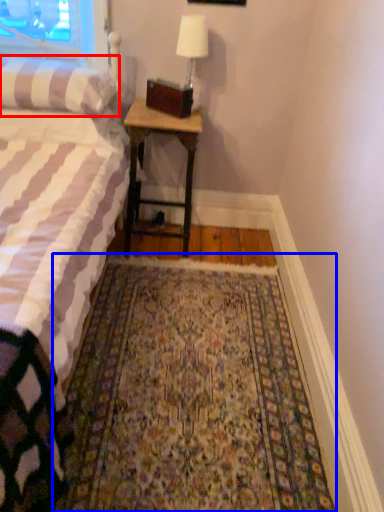
Question: Which point is further to the camera, pillow (highlighted by a red box) or mat (highlighted by a blue box)?

Choices:
 (A) pillow
 (B) mat

Answer: (A)